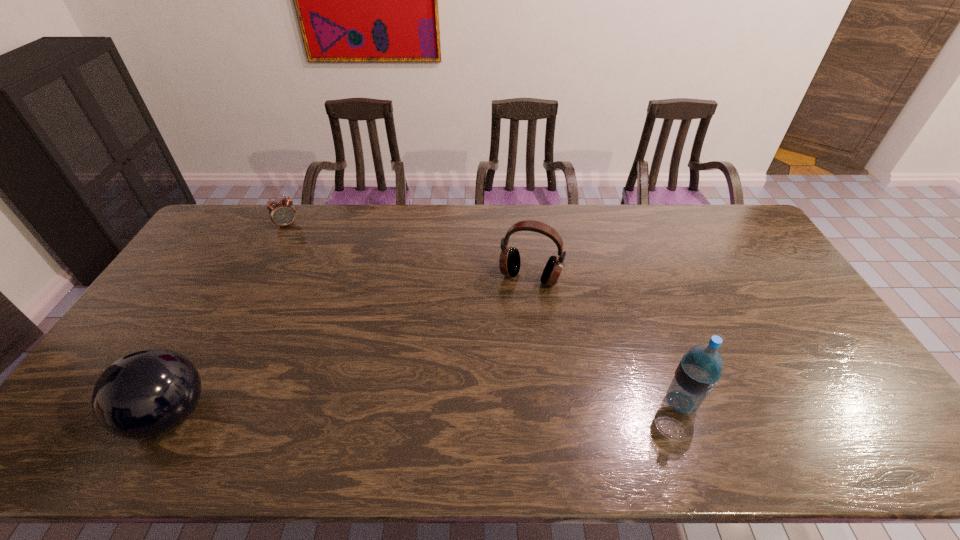
At what (x,y) coordinates should I click in order to perform the action: click on vacant area between the rightmost object and the alarm clock. Please return your answer as a coordinate pair (x, y). The image size is (960, 540). Looking at the image, I should click on (484, 314).

Locate an element on the screen. vacant space that is in between the shortest object and the rightmost object is located at coordinates 484,314.

Locate an element on the screen. This screenshot has height=540, width=960. unoccupied area between the alarm clock and the rightmost object is located at coordinates (484, 314).

Where is `free spot between the farthest object and the bowling ball`? Image resolution: width=960 pixels, height=540 pixels. free spot between the farthest object and the bowling ball is located at coordinates (228, 320).

Locate an element on the screen. Image resolution: width=960 pixels, height=540 pixels. empty space between the second object from right to left and the rightmost object is located at coordinates (605, 340).

Identify the location of blank region between the bowling ball and the alarm clock. (228, 320).

Identify the location of object that is the nearest to the second object from right to left. (699, 370).

Locate which object is the closest to the shortest object. Please provide its 2D coordinates. Your answer should be formatted as a tuple, i.e. [(x, y)], where the tuple contains the x and y coordinates of a point satisfying the conditions above.

[(145, 394)]